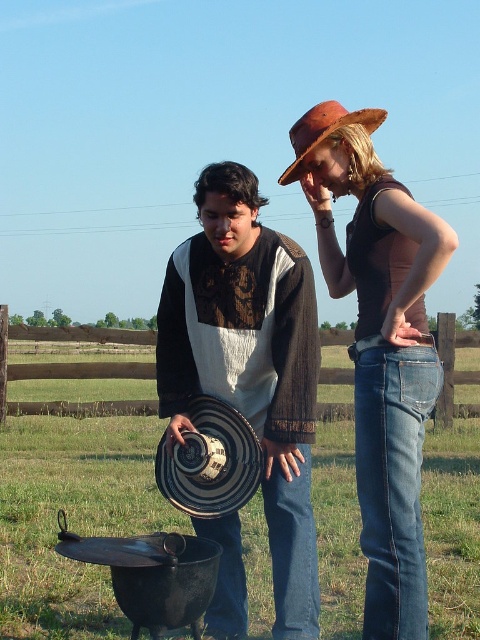
You are standing in a rural area and see two items at the center of the image. The striped straw hat at center and the denim jeans at center. Which item is closer to you?

The striped straw hat at center is closer to you because it is further to the viewer than the denim jeans at center.

Based on the photo, you are trying to decide which item takes up more visual space in the image. You see the denim jeans at center and the brown straw hat at upper center. Which one appears larger in the image?

The brown straw hat at upper center appears larger because it occupies more space than the denim jeans at center.

You are standing at the base of the wooden fence and want to throw a ball from the striped straw hat at center to the brown straw hat at upper center. What is the minimum distance you need to throw the ball?

The striped straw hat at center is 2.42 meters from the brown straw hat at upper center, so you need to throw the ball at least 2.42 meters to reach it.